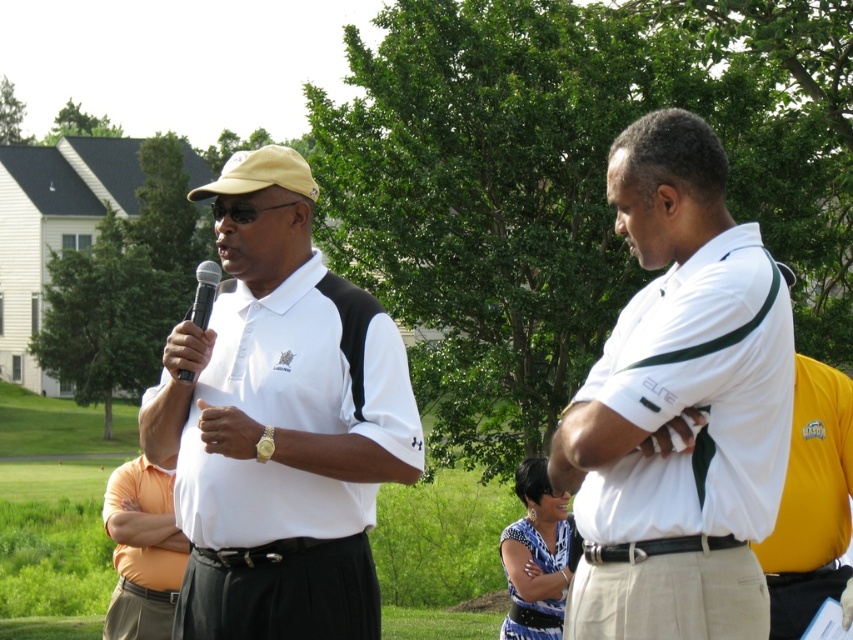
You are a photographer at the event and want to capture both the white smooth shirt at center and the orange cotton shirt at center in a single frame. Since the camera can only focus on one subject at a time, which shirt should you focus on to ensure the other remains in the background?

The white smooth shirt at center is above the orange cotton shirt at center, so focusing on the white smooth shirt at center will keep the orange cotton shirt at center in the background.

You are organizing a photo shoot and need to fit both the matte white polo shirt at center and the white smooth shirt at center into a small display case. Based on the scene description, which of the two shirts can you confidently place first to ensure both fit?

The matte white polo shirt at center occupies less space than the white smooth shirt at center, so you should place the matte white polo shirt at center first to ensure both fit in the display case.